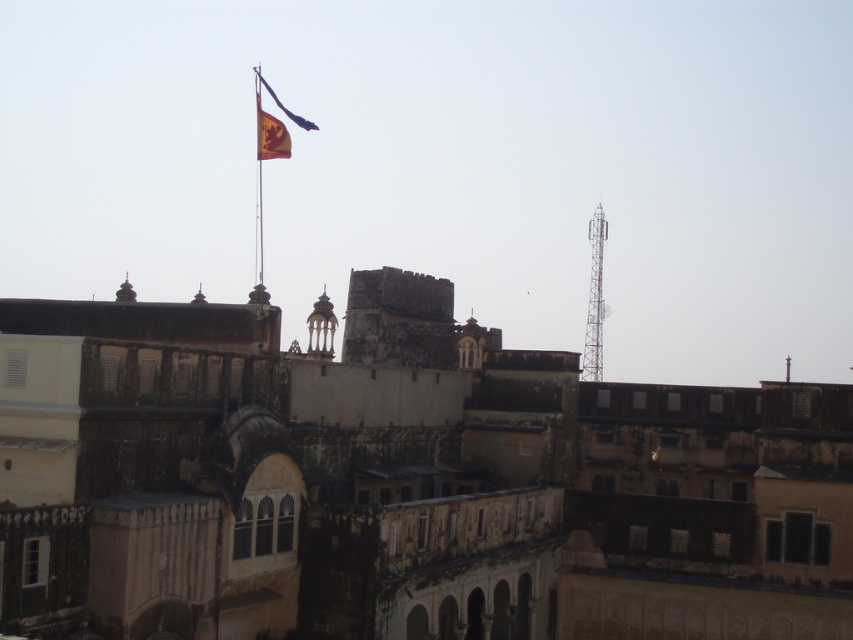
Question: Which object is farther from the camera taking this photo?

Choices:
 (A) metallic tower at right
 (B) metallic flag pole at upper center
 (C) yellow fabric flag at upper center

Answer: (C)

Question: Does metallic flag pole at upper center have a lesser width compared to yellow fabric flag at upper center?

Choices:
 (A) no
 (B) yes

Answer: (A)

Question: Can you confirm if red fabric flag at upper center is positioned to the left of yellow fabric flag at upper center?

Choices:
 (A) no
 (B) yes

Answer: (A)

Question: Estimate the real-world distances between objects in this image. Which object is closer to the red fabric flag at upper center?

Choices:
 (A) metallic tower at right
 (B) yellow fabric flag at upper center

Answer: (B)

Question: Is metallic tower at right positioned before red fabric flag at upper center?

Choices:
 (A) no
 (B) yes

Answer: (B)

Question: Which point is closer to the camera?

Choices:
 (A) metallic flag pole at upper center
 (B) red fabric flag at upper center
 (C) metallic tower at right
 (D) yellow fabric flag at upper center

Answer: (A)